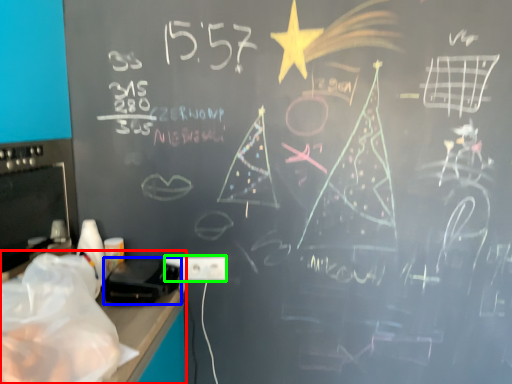
Question: Which object is positioned closest to computer desk (highlighted by a red box)? Select from equipment (highlighted by a blue box) and electric outlet (highlighted by a green box).

Choices:
 (A) equipment
 (B) electric outlet

Answer: (A)